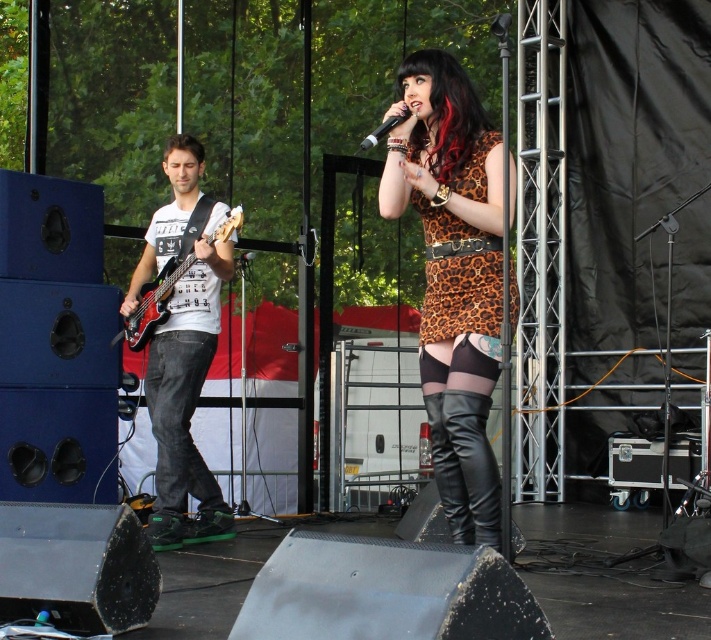
Does leather boots at center have a greater height compared to matte black microphone at center?

Yes.

Where is `leather boots at center`? The image size is (711, 640). leather boots at center is located at coordinates (449, 474).

Does point (449, 243) come farther from viewer compared to point (466, 515)?

No.

Does leopard print dress at center have a larger size compared to leather boots at center?

Correct, leopard print dress at center is larger in size than leather boots at center.

Who is more distant from viewer, (454,227) or (432,417)?

Positioned behind is point (432,417).

Where is `leopard print dress at center`? This screenshot has height=640, width=711. leopard print dress at center is located at coordinates 454,276.

Can you confirm if matte black bass guitar at left is shorter than leather boots at center?

No, matte black bass guitar at left is not shorter than leather boots at center.

Does matte black bass guitar at left lie in front of leather boots at center?

No, matte black bass guitar at left is further to the viewer.

Which is in front, point (188, 152) or point (437, 396)?

Point (437, 396)

I want to click on matte black bass guitar at left, so click(x=181, y=349).